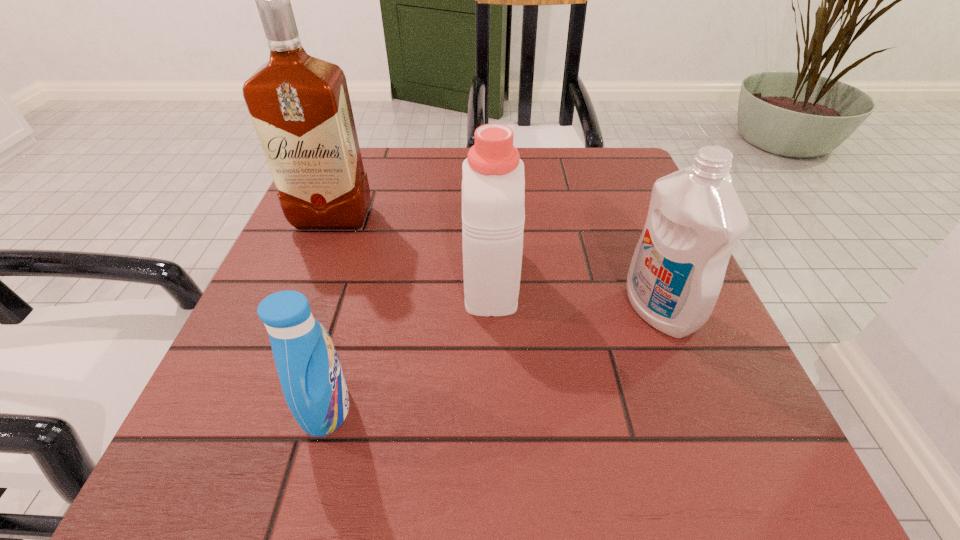
The image size is (960, 540). In order to click on vacant space located on the handle side of the second detergent from right to left in this screenshot , I will do `click(488, 163)`.

Identify the location of vacant region located on the front-facing side of the nearest detergent. (530, 409).

The height and width of the screenshot is (540, 960). Identify the location of object that is at the near edge. (310, 372).

Identify the location of liquor that is at the left edge. Image resolution: width=960 pixels, height=540 pixels. (300, 106).

Locate an element on the screen. The height and width of the screenshot is (540, 960). detergent located in the left edge section of the desktop is located at coordinates pos(310,372).

Where is `object positioned at the right edge`? The height and width of the screenshot is (540, 960). object positioned at the right edge is located at coordinates (695, 219).

Locate an element on the screen. object present at the near left corner is located at coordinates (310, 372).

In the image, there is a desktop. Identify the location of free space at the far edge. This screenshot has height=540, width=960. (440, 157).

The height and width of the screenshot is (540, 960). What are the coordinates of `vacant space at the near edge` in the screenshot? It's located at (341, 488).

Locate an element on the screen. vacant space at the left edge of the desktop is located at coordinates (291, 250).